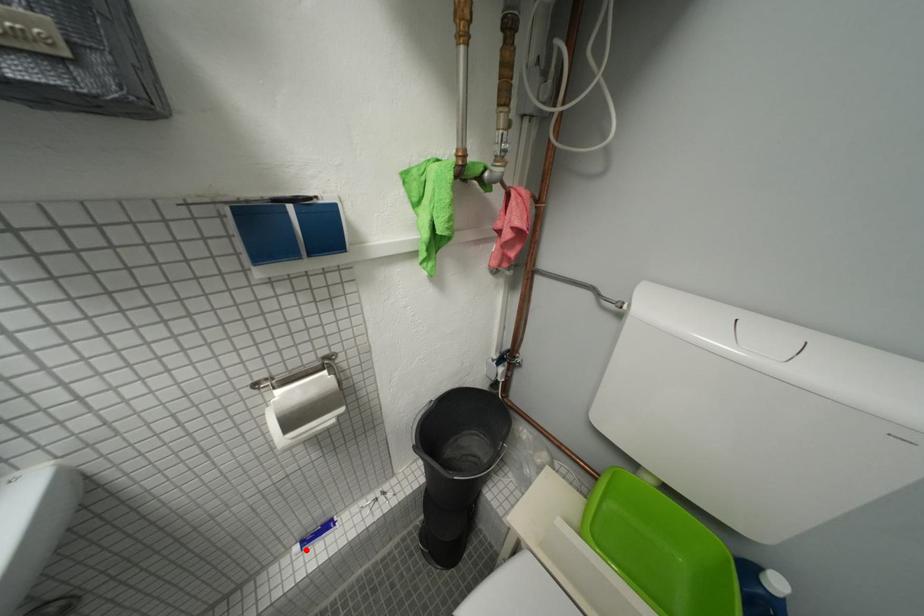
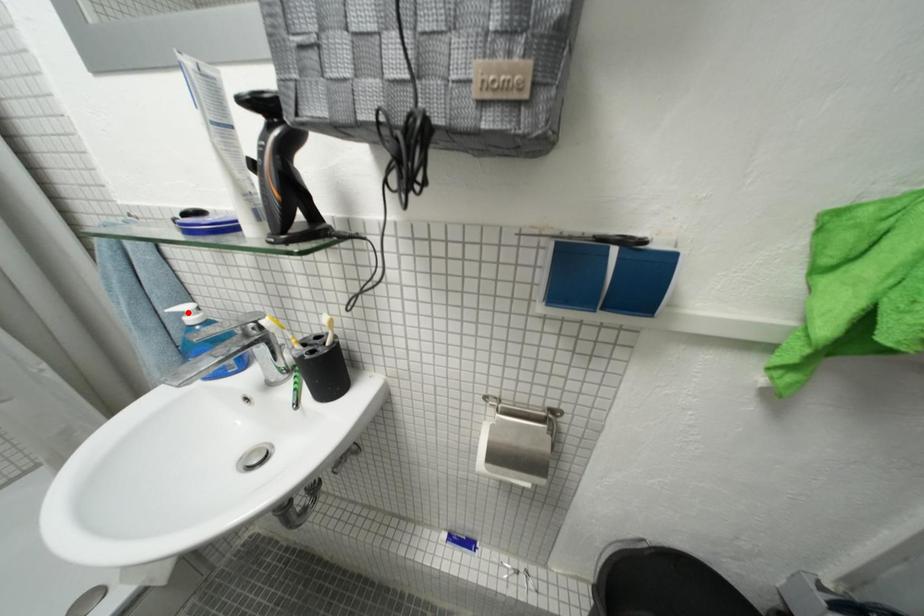
I am providing you with two images of the same scene from different viewpoints. A red point is marked on the first image and another point is marked on the second image. Are the points marked in image1 and image2 representing the same 3D position?

No